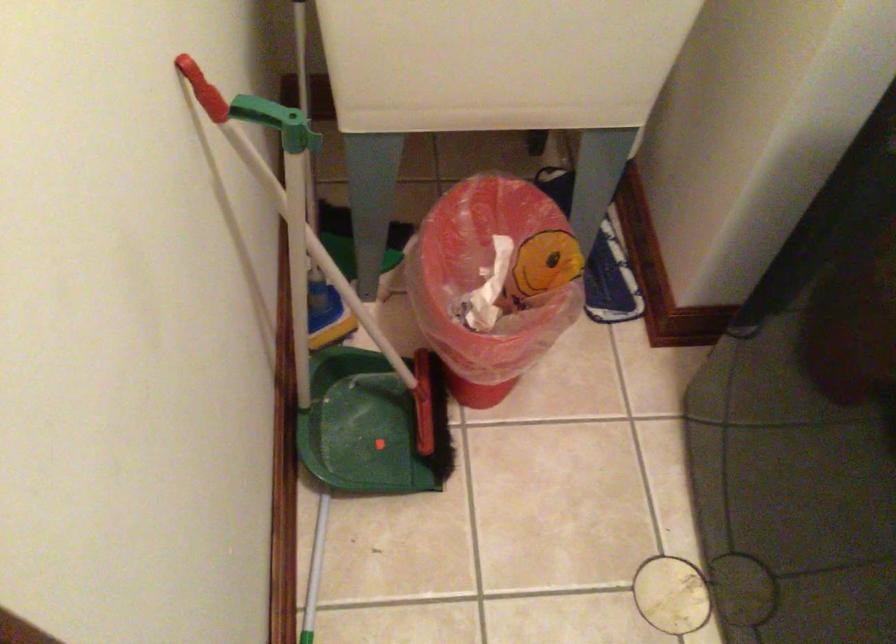
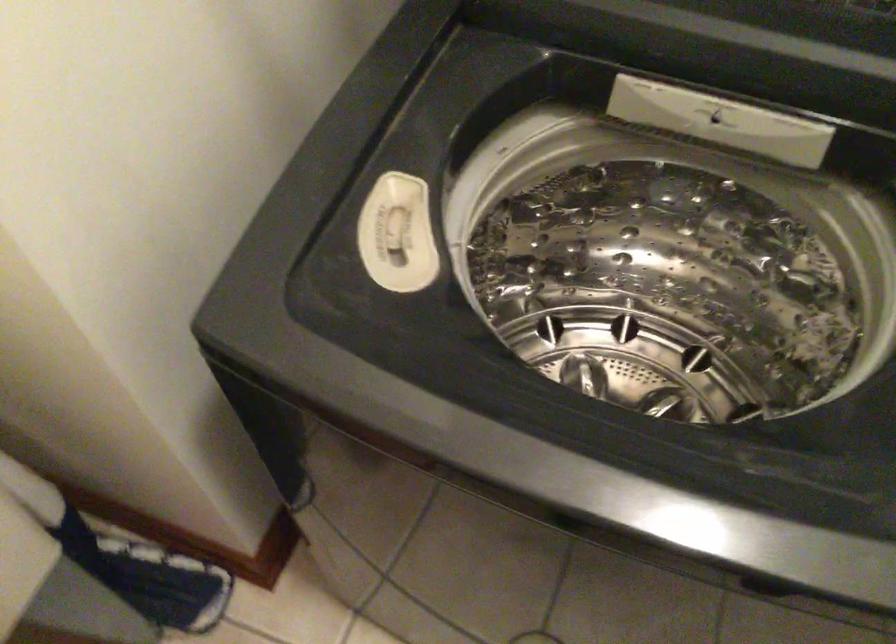
Question: I am providing you with two images of the same scene from different viewpoints. After the viewpoint changes to image2, which objects are now occluded?

Choices:
 (A) blue and white shoe
 (B) bleach dispenser switch
 (C) dispenser switch
 (D) none of these

Answer: (D)